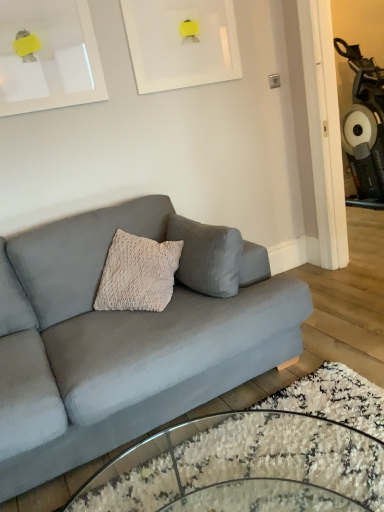
Question: Considering the relative sizes of matte gray couch at center and clear glass coffee table at lower center in the image provided, is matte gray couch at center bigger than clear glass coffee table at lower center?

Choices:
 (A) no
 (B) yes

Answer: (B)

Question: Can you confirm if matte gray couch at center is taller than clear glass coffee table at lower center?

Choices:
 (A) no
 (B) yes

Answer: (B)

Question: Is clear glass coffee table at lower center surrounded by matte gray couch at center?

Choices:
 (A) yes
 (B) no

Answer: (B)

Question: Is matte gray couch at center turned away from clear glass coffee table at lower center?

Choices:
 (A) yes
 (B) no

Answer: (B)

Question: Are matte gray couch at center and clear glass coffee table at lower center beside each other?

Choices:
 (A) no
 (B) yes

Answer: (A)

Question: From a real-world perspective, does matte gray couch at center sit lower than clear glass coffee table at lower center?

Choices:
 (A) no
 (B) yes

Answer: (A)

Question: Is white matte picture frame at upper center, the 1th picture frame positioned from the right, wider than clear glass coffee table at lower center?

Choices:
 (A) no
 (B) yes

Answer: (A)

Question: Is white matte picture frame at upper center, the second picture frame positioned from the left, taller than clear glass coffee table at lower center?

Choices:
 (A) no
 (B) yes

Answer: (B)

Question: From a real-world perspective, does white matte picture frame at upper center, the second picture frame positioned from the left, sit lower than clear glass coffee table at lower center?

Choices:
 (A) yes
 (B) no

Answer: (B)

Question: Is white matte picture frame at upper center, the 1th picture frame positioned from the right, facing towards clear glass coffee table at lower center?

Choices:
 (A) yes
 (B) no

Answer: (B)

Question: Does white matte picture frame at upper center, the 1th picture frame positioned from the right, appear on the left side of clear glass coffee table at lower center?

Choices:
 (A) no
 (B) yes

Answer: (B)

Question: Is white matte picture frame at upper center, the 1th picture frame positioned from the right, positioned far away from clear glass coffee table at lower center?

Choices:
 (A) no
 (B) yes

Answer: (B)

Question: Is the position of white matte picture frame at upper center, the 2th picture frame from the right, less distant than that of clear glass coffee table at lower center?

Choices:
 (A) yes
 (B) no

Answer: (B)